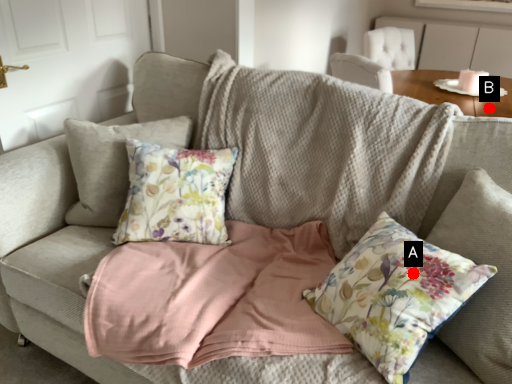
Question: Two points are circled on the image, labeled by A and B beside each circle. Which point is farther to the camera?

Choices:
 (A) A is further
 (B) B is further

Answer: (B)